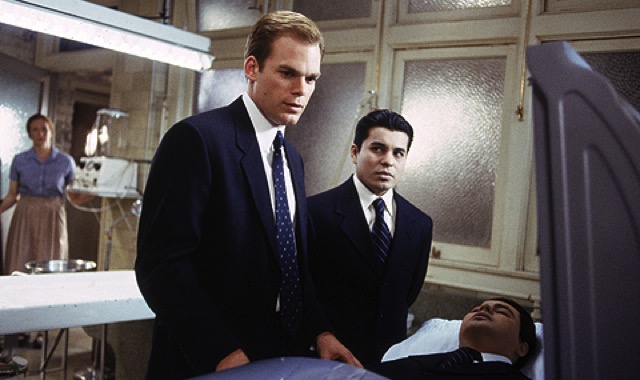
At what (x,y) coordinates should I click in order to perform the action: click on overhead light. Please return your answer as a coordinate pair (x, y). This screenshot has height=380, width=640. Looking at the image, I should click on (105, 35).